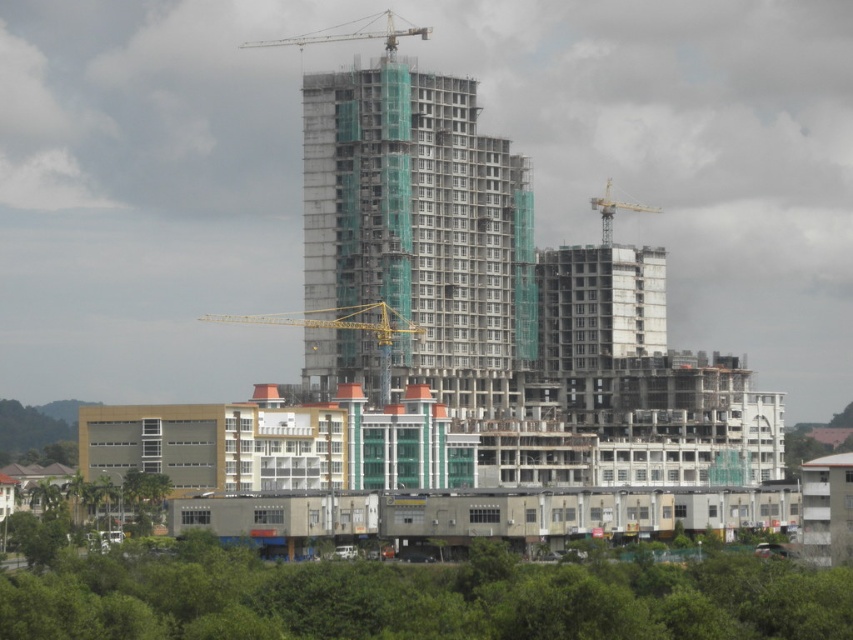
Between concrete scaffolding at center and yellow metallic crane at upper center, which one has more height?

With more height is concrete scaffolding at center.

From the picture: Can you confirm if concrete scaffolding at center is taller than yellow metallic crane at upper center?

Indeed, concrete scaffolding at center has a greater height compared to yellow metallic crane at upper center.

Does point (355, 348) come behind point (605, 214)?

No, (355, 348) is closer to viewer.

At what (x,y) coordinates should I click in order to perform the action: click on concrete scaffolding at center. Please return your answer as a coordinate pair (x, y). Looking at the image, I should click on (421, 225).

Does green leafy trees at lower center appear under metallic gray crane at upper center?

Correct, green leafy trees at lower center is located below metallic gray crane at upper center.

Does green leafy trees at lower center have a larger size compared to metallic gray crane at upper center?

No.

Is point (668, 625) behind point (310, 44)?

No, (668, 625) is closer to viewer.

Image resolution: width=853 pixels, height=640 pixels. I want to click on green leafy trees at lower center, so click(x=421, y=596).

Which is in front, point (556, 566) or point (334, 268)?

Point (556, 566) is in front.

Which of these two, green leafy trees at lower center or concrete scaffolding at center, stands shorter?

With less height is green leafy trees at lower center.

Is point (579, 577) positioned after point (482, 141)?

No, (579, 577) is closer to viewer.

Find the location of a particular element. Image resolution: width=853 pixels, height=640 pixels. green leafy trees at lower center is located at coordinates (421, 596).